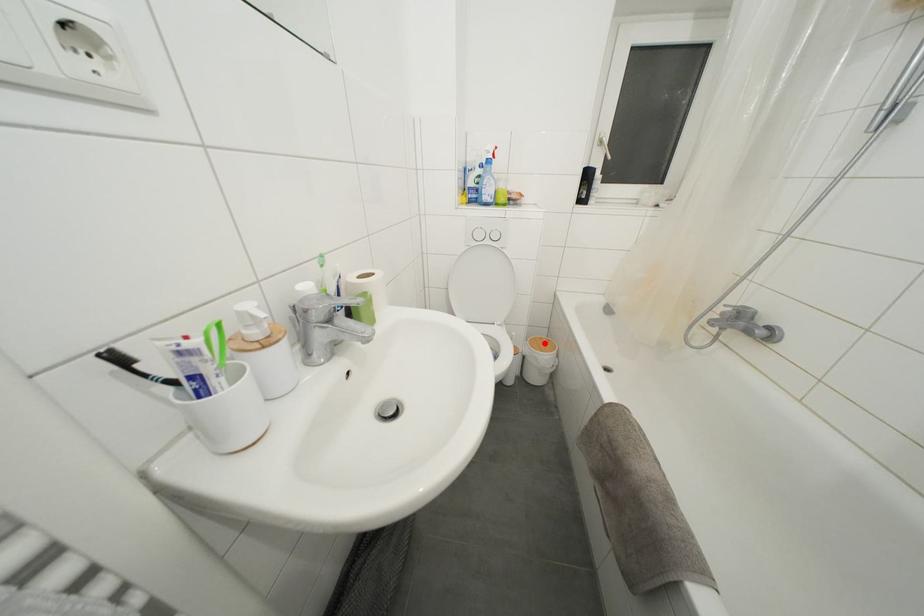
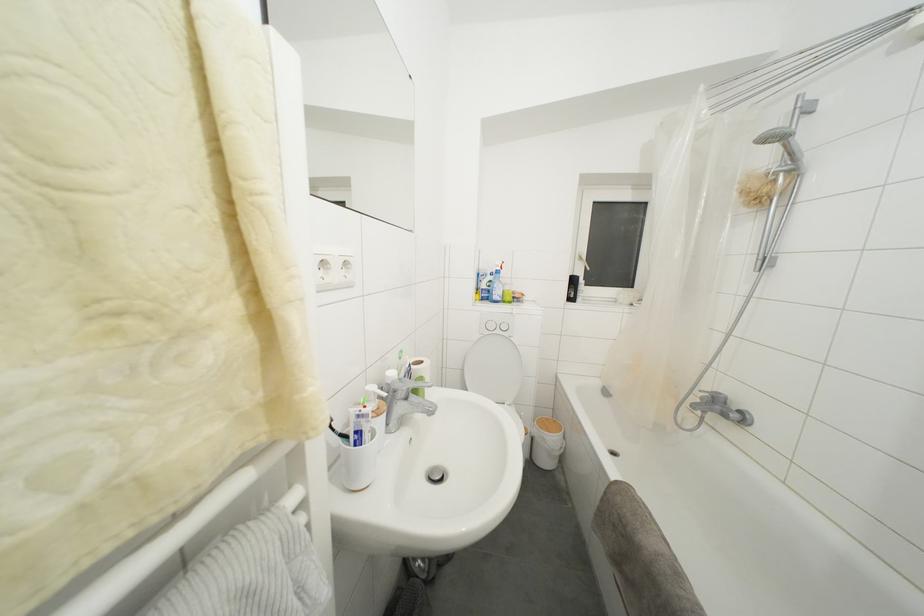
In the second image, find the point that corresponds to the highlighted location in the first image.

(552, 424)